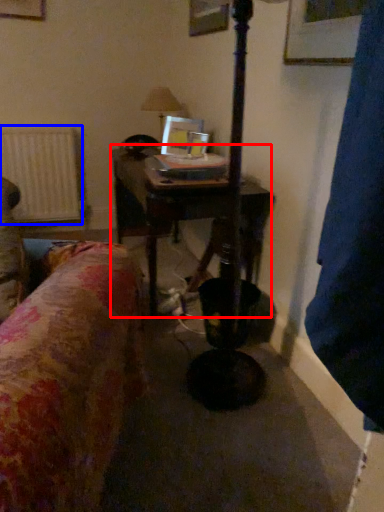
Question: Which point is further to the camera, table (highlighted by a red box) or radiator (highlighted by a blue box)?

Choices:
 (A) table
 (B) radiator

Answer: (B)